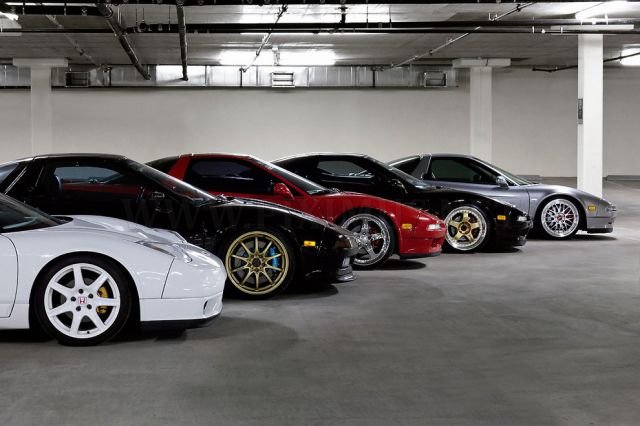
Locate an element on the screen. windows is located at coordinates (93, 178), (228, 177), (333, 167), (458, 162).